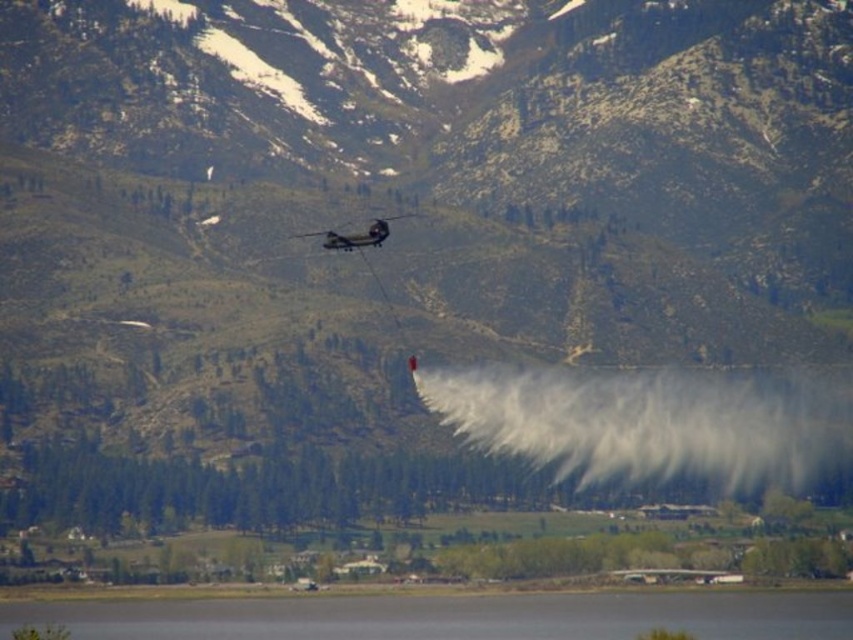
You are a drone operator trying to navigate through the scene. There is a point at coordinates point (x=451, y=616). What is located at this point?

The point (x=451, y=616) indicates transparent water at lower center.

You are a pilot flying a small plane and need to land in the area shown. The transparent water at lower center and the metallic gray helicopter at center are both visible. Which one is bigger in the image?

The transparent water at lower center has a larger size compared to the metallic gray helicopter at center, so the transparent water at lower center is bigger in the image.

You are a drone operator trying to capture a photo of the transparent water at lower center from your current position. The camera you are using has a maximum range of 600 meters. Can you successfully take the photo without moving closer?

The transparent water at lower center and camera are 653.00 meters apart from each other. Since the maximum range is 600 meters, the drone operator cannot successfully take the photo without moving closer.